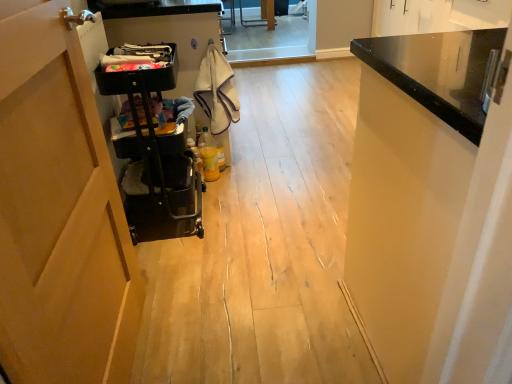
What do you see at coordinates (217, 90) in the screenshot?
I see `white cotton towel at center, the 1th laundry positioned from the back` at bounding box center [217, 90].

Measure the distance between black fabric laundry at upper center, which is the first laundry from left to right, and camera.

They are 1.60 meters apart.

The image size is (512, 384). In order to click on black plastic trolley at left in this screenshot , I will do `click(155, 159)`.

Looking at this image, is black glossy cabinet at upper right taller or shorter than white cotton towel at center, which is counted as the 1th laundry, starting from the right?

In the image, black glossy cabinet at upper right appears to be taller than white cotton towel at center, which is counted as the 1th laundry, starting from the right.

Does black glossy cabinet at upper right have a lesser width compared to white cotton towel at center, the 1th laundry positioned from the back?

Incorrect, the width of black glossy cabinet at upper right is not less than that of white cotton towel at center, the 1th laundry positioned from the back.

From the image's perspective, which object appears higher, black glossy cabinet at upper right or white cotton towel at center, which appears as the second laundry when viewed from the left?

From the image's view, white cotton towel at center, which appears as the second laundry when viewed from the left, is above.

In the scene shown: Considering the relative sizes of black glossy cabinet at upper right and white cotton towel at center, marked as the second laundry in a front-to-back arrangement, in the image provided, is black glossy cabinet at upper right smaller than white cotton towel at center, marked as the second laundry in a front-to-back arrangement,?

Actually, black glossy cabinet at upper right might be larger than white cotton towel at center, marked as the second laundry in a front-to-back arrangement.

From a real-world perspective, is black plastic trolley at left beneath white cotton towel at center, which appears as the second laundry when viewed from the left?

Yes.

Consider the image. Are black plastic trolley at left and white cotton towel at center, the 1th laundry positioned from the back, located far from each other?

No, black plastic trolley at left is not far away from white cotton towel at center, the 1th laundry positioned from the back.

Which point is more distant from viewer, (x=127, y=153) or (x=212, y=65)?

The point (x=212, y=65) is farther.

Is black plastic trolley at left aimed at white cotton towel at center, which appears as the second laundry when viewed from the left?

No, black plastic trolley at left does not turn towards white cotton towel at center, which appears as the second laundry when viewed from the left.

Can you confirm if white cotton towel at center, marked as the second laundry in a front-to-back arrangement, is positioned to the right of black plastic trolley at left?

Yes.

Which of these two, white cotton towel at center, which is counted as the 1th laundry, starting from the right, or black plastic trolley at left, stands shorter?

white cotton towel at center, which is counted as the 1th laundry, starting from the right, is shorter.

In the scene shown: Considering the sizes of objects black fabric laundry at upper center, which is the 1th laundry in front-to-back order, and white cotton towel at center, which appears as the second laundry when viewed from the left, in the image provided, who is taller, black fabric laundry at upper center, which is the 1th laundry in front-to-back order, or white cotton towel at center, which appears as the second laundry when viewed from the left,?

white cotton towel at center, which appears as the second laundry when viewed from the left, is taller.

Which is nearer, (x=137, y=67) or (x=239, y=119)?

Clearly, point (x=137, y=67) is closer to the camera than point (x=239, y=119).

Can you confirm if black fabric laundry at upper center, the second laundry viewed from the back, is thinner than white cotton towel at center, marked as the second laundry in a front-to-back arrangement?

No.

Does white cotton towel at center, which appears as the second laundry when viewed from the left, touch black fabric laundry at upper center, which is the first laundry from left to right?

white cotton towel at center, which appears as the second laundry when viewed from the left, is not next to black fabric laundry at upper center, which is the first laundry from left to right, and they're not touching.

Is point (224, 94) positioned behind point (162, 58)?

Yes, point (224, 94) is farther from viewer.

Could you tell me if black glossy cabinet at upper right is turned towards black plastic trolley at left?

No.

Considering the positions of objects black glossy cabinet at upper right and black plastic trolley at left in the image provided, who is more to the right, black glossy cabinet at upper right or black plastic trolley at left?

black glossy cabinet at upper right is more to the right.

From the image's perspective, is black glossy cabinet at upper right below black plastic trolley at left?

Correct, black glossy cabinet at upper right appears lower than black plastic trolley at left in the image.

Which object is wider, black glossy cabinet at upper right or black plastic trolley at left?

Wider between the two is black glossy cabinet at upper right.

Is black fabric laundry at upper center, the second laundry viewed from the back, oriented away from black glossy cabinet at upper right?

No, black fabric laundry at upper center, the second laundry viewed from the back, is not facing the opposite direction of black glossy cabinet at upper right.

From a real-world perspective, relative to black glossy cabinet at upper right, is black fabric laundry at upper center, the second laundry viewed from the right, vertically above or below?

From a real-world perspective, black fabric laundry at upper center, the second laundry viewed from the right, is physically above black glossy cabinet at upper right.

What's the angular difference between black fabric laundry at upper center, the second laundry viewed from the right, and black glossy cabinet at upper right's facing directions?

There is a 91.3-degree angle between the facing directions of black fabric laundry at upper center, the second laundry viewed from the right, and black glossy cabinet at upper right.

Which is less distant, (130,53) or (504,97)?

Positioned in front is point (504,97).

Identify the location of cabinetry below the white cotton towel at center, which appears as the second laundry when viewed from the left (from a real-world perspective). The height and width of the screenshot is (384, 512). (432, 208).

Where is `the 1st laundry directly above the black plastic trolley at left (from a real-world perspective)`? This screenshot has width=512, height=384. the 1st laundry directly above the black plastic trolley at left (from a real-world perspective) is located at coordinates (217, 90).

Estimate the real-world distances between objects in this image. Which object is further from black fabric laundry at upper center, the second laundry viewed from the back, black glossy cabinet at upper right or white cotton towel at center, which appears as the second laundry when viewed from the left?

black glossy cabinet at upper right.

From the image, which object appears to be nearer to black glossy cabinet at upper right, white cotton towel at center, which appears as the second laundry when viewed from the left, or black plastic trolley at left?

black plastic trolley at left.

When comparing their distances from black glossy cabinet at upper right, does black plastic trolley at left or black fabric laundry at upper center, which is the 1th laundry in front-to-back order, seem closer?

black plastic trolley at left.

Which object lies further to the anchor point white cotton towel at center, which appears as the second laundry when viewed from the left, black glossy cabinet at upper right or black plastic trolley at left?

Based on the image, black glossy cabinet at upper right appears to be further to white cotton towel at center, which appears as the second laundry when viewed from the left.

From the image, which object appears to be farther from black fabric laundry at upper center, which is the first laundry from left to right, black plastic trolley at left or white cotton towel at center, which is counted as the 1th laundry, starting from the right?

white cotton towel at center, which is counted as the 1th laundry, starting from the right, is further to black fabric laundry at upper center, which is the first laundry from left to right.

From the image, which object appears to be farther from black fabric laundry at upper center, which is the 1th laundry in front-to-back order, white cotton towel at center, marked as the second laundry in a front-to-back arrangement, or black plastic trolley at left?

white cotton towel at center, marked as the second laundry in a front-to-back arrangement, lies further to black fabric laundry at upper center, which is the 1th laundry in front-to-back order, than the other object.

Based on their spatial positions, is black fabric laundry at upper center, the second laundry viewed from the back, or black plastic trolley at left further from white cotton towel at center, which is counted as the 1th laundry, starting from the right?

Based on the image, black plastic trolley at left appears to be further to white cotton towel at center, which is counted as the 1th laundry, starting from the right.

Looking at the image, which one is located further to white cotton towel at center, marked as the second laundry in a front-to-back arrangement, black plastic trolley at left or black fabric laundry at upper center, the second laundry viewed from the right?

black plastic trolley at left is positioned further to the anchor white cotton towel at center, marked as the second laundry in a front-to-back arrangement.

I want to click on laundry between black glossy cabinet at upper right and white cotton towel at center, the 1th laundry positioned from the back, along the z-axis, so pyautogui.click(x=136, y=57).

Where is `trolley between black fabric laundry at upper center, the second laundry viewed from the back, and black glossy cabinet at upper right from left to right`? The height and width of the screenshot is (384, 512). trolley between black fabric laundry at upper center, the second laundry viewed from the back, and black glossy cabinet at upper right from left to right is located at coordinates (155, 159).

Locate an element on the screen. This screenshot has width=512, height=384. laundry between black plastic trolley at left and white cotton towel at center, the 1th laundry positioned from the back, along the z-axis is located at coordinates (136, 57).

I want to click on trolley located between black glossy cabinet at upper right and white cotton towel at center, the 1th laundry positioned from the back, in the depth direction, so click(x=155, y=159).